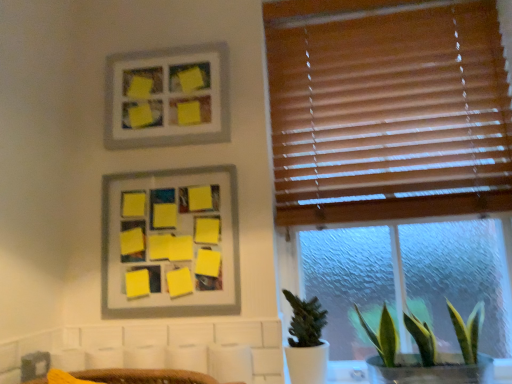
At what (x,y) coordinates should I click in order to perform the action: click on green leafy plant at lower right, which ranks as the 1th houseplant in right-to-left order. Please return your answer as a coordinate pair (x, y). Image resolution: width=512 pixels, height=384 pixels. Looking at the image, I should click on (426, 353).

You are a GUI agent. You are given a task and a screenshot of the screen. Output one action in this format:
    pyautogui.click(x=<x>, y=<y>)
    Task: Click on the green matte plant at lower right, which appears as the first houseplant when viewed from the left
    This screenshot has height=384, width=512.
    Given the screenshot: What is the action you would take?
    pyautogui.click(x=306, y=341)

This screenshot has height=384, width=512. I want to click on yellow matte board at upper center, which is the first picture frame in bottom-to-top order, so click(170, 240).

Image resolution: width=512 pixels, height=384 pixels. Identify the location of wooden blinds at upper right. (387, 110).

From a real-world perspective, relative to yellow matte picture frame at upper center, which is the 2th picture frame from bottom to top, is yellow matte board at upper center, which appears as the 2th picture frame when viewed from the top, vertically above or below?

In terms of real-world spatial position, yellow matte board at upper center, which appears as the 2th picture frame when viewed from the top, is below yellow matte picture frame at upper center, which is the 2th picture frame from bottom to top.

Considering the sizes of objects yellow matte board at upper center, which appears as the 2th picture frame when viewed from the top, and yellow matte picture frame at upper center, the first picture frame from the top, in the image provided, who is shorter, yellow matte board at upper center, which appears as the 2th picture frame when viewed from the top, or yellow matte picture frame at upper center, the first picture frame from the top,?

With less height is yellow matte picture frame at upper center, the first picture frame from the top.

How different are the orientations of yellow matte board at upper center, which is the first picture frame in bottom-to-top order, and yellow matte picture frame at upper center, which is the 2th picture frame from bottom to top, in degrees?

They differ by 0.575 degrees in their facing directions.

From the image's perspective, who appears lower, yellow matte board at upper center, which is the first picture frame in bottom-to-top order, or yellow matte picture frame at upper center, which is the 2th picture frame from bottom to top?

yellow matte board at upper center, which is the first picture frame in bottom-to-top order.

This screenshot has width=512, height=384. I want to click on houseplant that is the 2nd one below the yellow matte board at upper center, which is the first picture frame in bottom-to-top order (from a real-world perspective), so click(x=426, y=353).

How different are the orientations of green leafy plant at lower right, which ranks as the 1th houseplant in right-to-left order, and yellow matte board at upper center, which is the first picture frame in bottom-to-top order, in degrees?

The angular difference between green leafy plant at lower right, which ranks as the 1th houseplant in right-to-left order, and yellow matte board at upper center, which is the first picture frame in bottom-to-top order, is 0.855 degrees.

From a real-world perspective, is green leafy plant at lower right, the second houseplant when ordered from left to right, positioned over yellow matte board at upper center, which is the first picture frame in bottom-to-top order, based on gravity?

No, from a real-world perspective, green leafy plant at lower right, the second houseplant when ordered from left to right, is not on top of yellow matte board at upper center, which is the first picture frame in bottom-to-top order.

Is wooden blinds at upper right completely or partially inside green matte plant at lower right, which appears as the first houseplant when viewed from the left?

No, green matte plant at lower right, which appears as the first houseplant when viewed from the left, does not contain wooden blinds at upper right.

Is point (296, 351) more distant than point (318, 144)?

No.

Looking at this image, considering the relative sizes of green matte plant at lower right, which is the second houseplant in right-to-left order, and wooden blinds at upper right in the image provided, is green matte plant at lower right, which is the second houseplant in right-to-left order, taller than wooden blinds at upper right?

In fact, green matte plant at lower right, which is the second houseplant in right-to-left order, may be shorter than wooden blinds at upper right.

Is green matte plant at lower right, which is the second houseplant in right-to-left order, not near wooden blinds at upper right?

green matte plant at lower right, which is the second houseplant in right-to-left order, is actually quite close to wooden blinds at upper right.

Between point (345, 106) and point (390, 341), which one is positioned in front?

The point (390, 341) is more forward.

Can you confirm if wooden blinds at upper right is thinner than green leafy plant at lower right, the second houseplant when ordered from left to right?

Yes.

In the scene shown: Between wooden blinds at upper right and green leafy plant at lower right, which ranks as the 1th houseplant in right-to-left order, which one appears on the left side from the viewer's perspective?

From the viewer's perspective, wooden blinds at upper right appears more on the left side.

From a real-world perspective, which object stands above the other?

wooden blinds at upper right is physically above.

Is there a large distance between wooden blinds at upper right and yellow matte picture frame at upper center, the first picture frame from the top?

No, wooden blinds at upper right is not far from yellow matte picture frame at upper center, the first picture frame from the top.

Considering the positions of points (271, 3) and (112, 74), is point (271, 3) closer to camera compared to point (112, 74)?

That is False.

Looking at this image, could you measure the distance between wooden blinds at upper right and yellow matte picture frame at upper center, the first picture frame from the top?

They are 48.04 centimeters apart.

How different are the orientations of wooden blinds at upper right and yellow matte picture frame at upper center, which is the 2th picture frame from bottom to top, in degrees?

wooden blinds at upper right and yellow matte picture frame at upper center, which is the 2th picture frame from bottom to top, are facing 0.315 degrees away from each other.

From a real-world perspective, is yellow matte board at upper center, which appears as the 2th picture frame when viewed from the top, over wooden blinds at upper right?

No.

How many degrees apart are the facing directions of yellow matte board at upper center, which is the first picture frame in bottom-to-top order, and wooden blinds at upper right?

0.26 degrees.

Where is `window behind the yellow matte board at upper center, which appears as the 2th picture frame when viewed from the top`? window behind the yellow matte board at upper center, which appears as the 2th picture frame when viewed from the top is located at coordinates (387, 110).

Which object is further away from the camera taking this photo, yellow matte board at upper center, which appears as the 2th picture frame when viewed from the top, or wooden blinds at upper right?

wooden blinds at upper right is further away from the camera.

Does yellow matte board at upper center, which is the first picture frame in bottom-to-top order, appear on the left side of green leafy plant at lower right, the second houseplant when ordered from left to right?

Indeed, yellow matte board at upper center, which is the first picture frame in bottom-to-top order, is positioned on the left side of green leafy plant at lower right, the second houseplant when ordered from left to right.

Is yellow matte board at upper center, which appears as the 2th picture frame when viewed from the top, aimed at green leafy plant at lower right, the second houseplant when ordered from left to right?

A: No, yellow matte board at upper center, which appears as the 2th picture frame when viewed from the top, is not oriented towards green leafy plant at lower right, the second houseplant when ordered from left to right.

Consider the image. Is yellow matte board at upper center, which appears as the 2th picture frame when viewed from the top, closer to camera compared to green leafy plant at lower right, which ranks as the 1th houseplant in right-to-left order?

No.

Is yellow matte board at upper center, which appears as the 2th picture frame when viewed from the top, not inside green leafy plant at lower right, which ranks as the 1th houseplant in right-to-left order?

Indeed, yellow matte board at upper center, which appears as the 2th picture frame when viewed from the top, is completely outside green leafy plant at lower right, which ranks as the 1th houseplant in right-to-left order.

I want to click on picture frame above the yellow matte board at upper center, which appears as the 2th picture frame when viewed from the top (from a real-world perspective), so click(167, 97).

Locate an element on the screen. The image size is (512, 384). the 1st picture frame behind the green leafy plant at lower right, which ranks as the 1th houseplant in right-to-left order is located at coordinates (170, 240).

From the picture: Considering their positions, is green leafy plant at lower right, which ranks as the 1th houseplant in right-to-left order, positioned further to wooden blinds at upper right than yellow matte picture frame at upper center, the first picture frame from the top?

The object further to wooden blinds at upper right is green leafy plant at lower right, which ranks as the 1th houseplant in right-to-left order.

When comparing their distances from yellow matte picture frame at upper center, which is the 2th picture frame from bottom to top, does yellow matte board at upper center, which appears as the 2th picture frame when viewed from the top, or wooden blinds at upper right seem closer?

The object closer to yellow matte picture frame at upper center, which is the 2th picture frame from bottom to top, is yellow matte board at upper center, which appears as the 2th picture frame when viewed from the top.

Which object lies further to the anchor point green matte plant at lower right, which appears as the first houseplant when viewed from the left, yellow matte board at upper center, which appears as the 2th picture frame when viewed from the top, or green leafy plant at lower right, the second houseplant when ordered from left to right?

yellow matte board at upper center, which appears as the 2th picture frame when viewed from the top, lies further to green matte plant at lower right, which appears as the first houseplant when viewed from the left, than the other object.

Looking at the image, which one is located further to green leafy plant at lower right, the second houseplant when ordered from left to right, yellow matte board at upper center, which appears as the 2th picture frame when viewed from the top, or yellow matte picture frame at upper center, which is the 2th picture frame from bottom to top?

Based on the image, yellow matte picture frame at upper center, which is the 2th picture frame from bottom to top, appears to be further to green leafy plant at lower right, the second houseplant when ordered from left to right.

When comparing their distances from wooden blinds at upper right, does yellow matte board at upper center, which appears as the 2th picture frame when viewed from the top, or green matte plant at lower right, which is the second houseplant in right-to-left order, seem closer?

yellow matte board at upper center, which appears as the 2th picture frame when viewed from the top, is closer to wooden blinds at upper right.

Which object lies nearer to the anchor point yellow matte board at upper center, which appears as the 2th picture frame when viewed from the top, yellow matte picture frame at upper center, the first picture frame from the top, or green leafy plant at lower right, which ranks as the 1th houseplant in right-to-left order?

yellow matte picture frame at upper center, the first picture frame from the top, lies closer to yellow matte board at upper center, which appears as the 2th picture frame when viewed from the top, than the other object.

Considering their positions, is green matte plant at lower right, which is the second houseplant in right-to-left order, positioned further to yellow matte picture frame at upper center, the first picture frame from the top, than wooden blinds at upper right?

The object further to yellow matte picture frame at upper center, the first picture frame from the top, is green matte plant at lower right, which is the second houseplant in right-to-left order.

When comparing their distances from yellow matte board at upper center, which is the first picture frame in bottom-to-top order, does green leafy plant at lower right, the second houseplant when ordered from left to right, or green matte plant at lower right, which appears as the first houseplant when viewed from the left, seem further?

The object further to yellow matte board at upper center, which is the first picture frame in bottom-to-top order, is green leafy plant at lower right, the second houseplant when ordered from left to right.

At what (x,y) coordinates should I click in order to perform the action: click on houseplant between yellow matte picture frame at upper center, the first picture frame from the top, and green leafy plant at lower right, which ranks as the 1th houseplant in right-to-left order, from top to bottom. Please return your answer as a coordinate pair (x, y). Looking at the image, I should click on (306, 341).

Identify the location of picture frame situated between yellow matte picture frame at upper center, the first picture frame from the top, and green leafy plant at lower right, the second houseplant when ordered from left to right, from left to right. The height and width of the screenshot is (384, 512). (170, 240).

This screenshot has height=384, width=512. I want to click on houseplant that lies between wooden blinds at upper right and green leafy plant at lower right, which ranks as the 1th houseplant in right-to-left order, from top to bottom, so click(306, 341).

Identify the location of houseplant situated between yellow matte board at upper center, which is the first picture frame in bottom-to-top order, and green leafy plant at lower right, which ranks as the 1th houseplant in right-to-left order, from left to right. This screenshot has width=512, height=384. (306, 341).